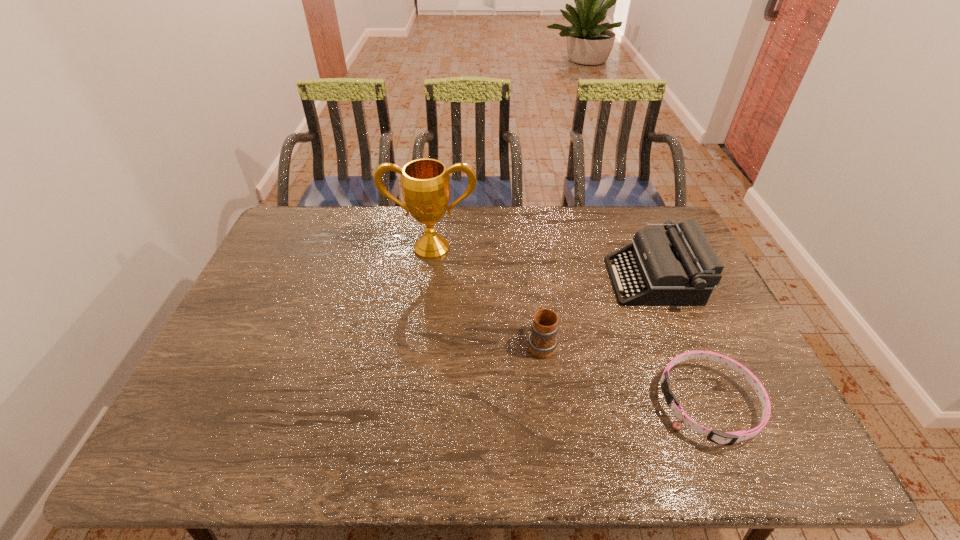
This screenshot has height=540, width=960. I want to click on free space between the typewriter and the leftmost object, so click(x=542, y=264).

This screenshot has height=540, width=960. What are the coordinates of `free space between the second object from left to right and the typewriter` in the screenshot? It's located at (597, 312).

Image resolution: width=960 pixels, height=540 pixels. In order to click on empty space that is in between the typewriter and the tallest object in this screenshot , I will do `click(542, 264)`.

I want to click on vacant area that lies between the award and the dog collar, so click(x=570, y=326).

Locate an element on the screen. This screenshot has width=960, height=540. free space between the second tallest object and the shortest object is located at coordinates (681, 342).

Where is `unoccupied area between the typewriter and the dog collar`? Image resolution: width=960 pixels, height=540 pixels. unoccupied area between the typewriter and the dog collar is located at coordinates pyautogui.click(x=681, y=342).

Choose which object is the nearest neighbor to the award. Please provide its 2D coordinates. Your answer should be formatted as a tuple, i.e. [(x, y)], where the tuple contains the x and y coordinates of a point satisfying the conditions above.

[(542, 341)]

You are a GUI agent. You are given a task and a screenshot of the screen. Output one action in this format:
    pyautogui.click(x=<x>, y=<y>)
    Task: Click on the object that is the second closest to the second nearest object
    
    Given the screenshot: What is the action you would take?
    pyautogui.click(x=728, y=438)